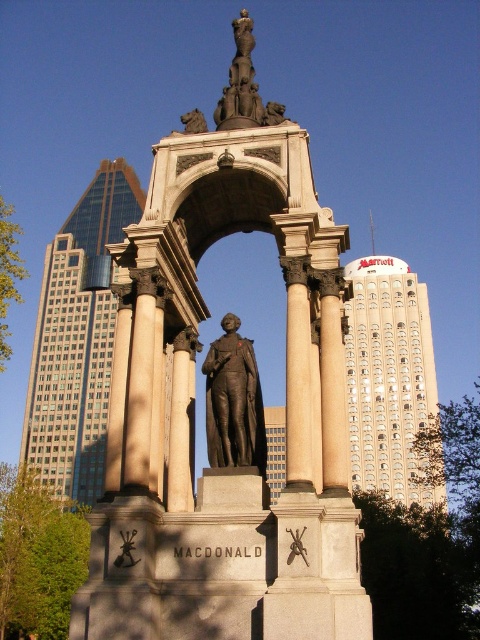
Question: Which point is closer to the camera?

Choices:
 (A) (59, 390)
 (B) (224, 109)
 (C) (233, 330)
 (D) (288, 280)

Answer: (D)

Question: Is white glass tower at upper right bigger than polished bronze statue at upper center?

Choices:
 (A) yes
 (B) no

Answer: (A)

Question: From the image, what is the correct spatial relationship of polished stone column at center in relation to polished bronze statue at upper center?

Choices:
 (A) below
 (B) above

Answer: (A)

Question: Estimate the real-world distances between objects in this image. Which object is farther from the glassy steel skyscraper at left?

Choices:
 (A) white glass tower at upper right
 (B) polished bronze statue at upper center

Answer: (B)

Question: Is white marble column at center to the right of polished bronze statue at upper center from the viewer's perspective?

Choices:
 (A) no
 (B) yes

Answer: (B)

Question: Which is nearer to the bronze statue at center?

Choices:
 (A) polished bronze statue at upper center
 (B) glassy steel skyscraper at left
 (C) white marble column at center
 (D) black polished statue at center

Answer: (D)